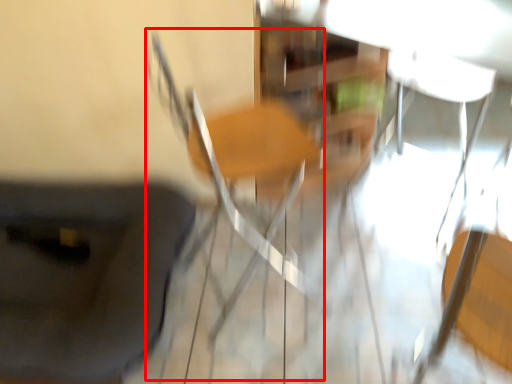
Question: Where is chair (annotated by the red box) located in relation to furniture in the image?

Choices:
 (A) right
 (B) left

Answer: (A)